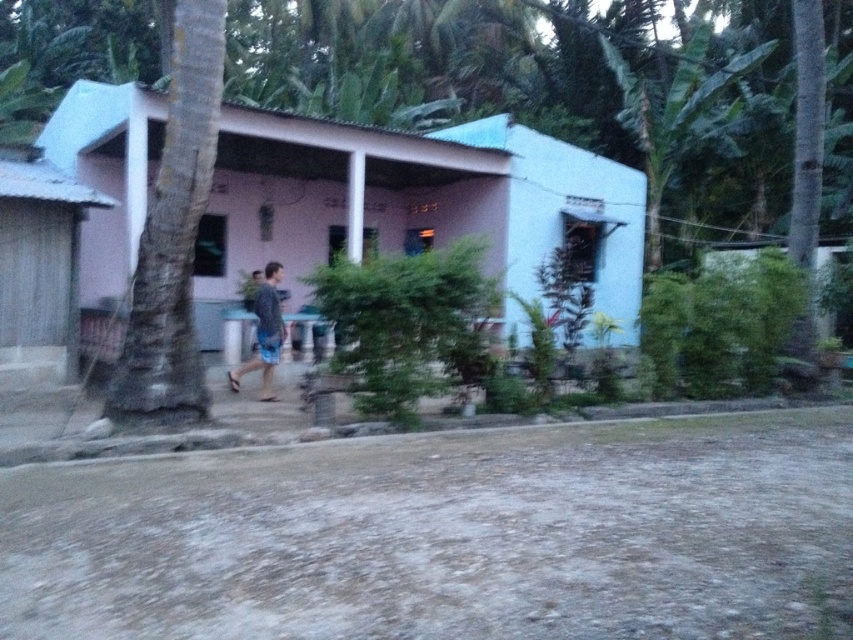
You are a delivery person trying to determine the best path to the front door of the pink matte house at center. You notice the blue denim shorts at center nearby. Which object should you avoid stepping on to reach the house safely?

You should avoid stepping on the blue denim shorts at center because the pink matte house at center is larger and likely the structure you need to reach, while the blue denim shorts at center may be an obstacle or personal item in the path.

You are standing at the point marked by point (415, 205). What object are you directly facing?

You are directly facing the pink matte house at center.